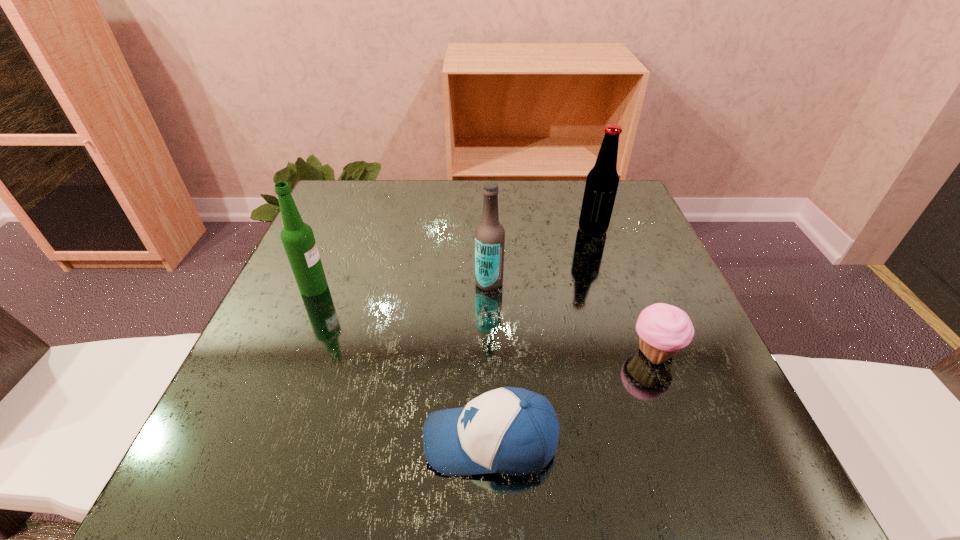
Where is `the third closest beer bottle to the nearest object`? This screenshot has height=540, width=960. the third closest beer bottle to the nearest object is located at coordinates (602, 181).

The height and width of the screenshot is (540, 960). Identify the location of vacant space that satisfies the following two spatial constraints: 1. on the front side of the rightmost beer bottle; 2. on the front-facing side of the nearest object. (663, 441).

The width and height of the screenshot is (960, 540). Find the location of `free space that satisfies the following two spatial constraints: 1. on the label of the leftmost beer bottle; 2. on the back side of the cupcake`. free space that satisfies the following two spatial constraints: 1. on the label of the leftmost beer bottle; 2. on the back side of the cupcake is located at coordinates (286, 354).

Find the location of `free space in the image that satisfies the following two spatial constraints: 1. on the front side of the rightmost beer bottle; 2. on the label of the leftmost object`. free space in the image that satisfies the following two spatial constraints: 1. on the front side of the rightmost beer bottle; 2. on the label of the leftmost object is located at coordinates (612, 287).

Locate an element on the screen. The image size is (960, 540). vacant space that satisfies the following two spatial constraints: 1. on the label of the second beer bottle from right to left; 2. on the left side of the cupcake is located at coordinates 491,354.

The width and height of the screenshot is (960, 540). In order to click on blank space that satisfies the following two spatial constraints: 1. on the label of the second beer bottle from left to right; 2. on the back side of the fourth farthest object in this screenshot , I will do pyautogui.click(x=491, y=354).

The width and height of the screenshot is (960, 540). Find the location of `free region that satisfies the following two spatial constraints: 1. on the label of the leftmost beer bottle; 2. on the back side of the cupcake`. free region that satisfies the following two spatial constraints: 1. on the label of the leftmost beer bottle; 2. on the back side of the cupcake is located at coordinates (286, 354).